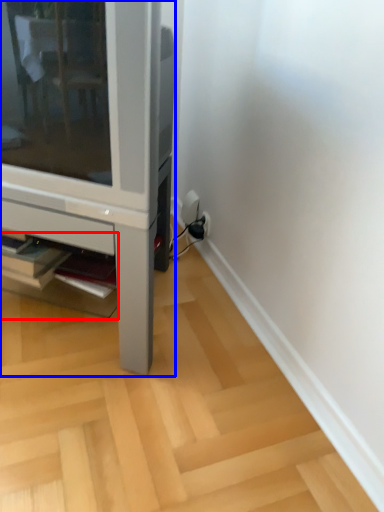
Question: Among these objects, which one is nearest to the camera, shelf (highlighted by a red box) or furniture (highlighted by a blue box)?

Choices:
 (A) shelf
 (B) furniture

Answer: (B)